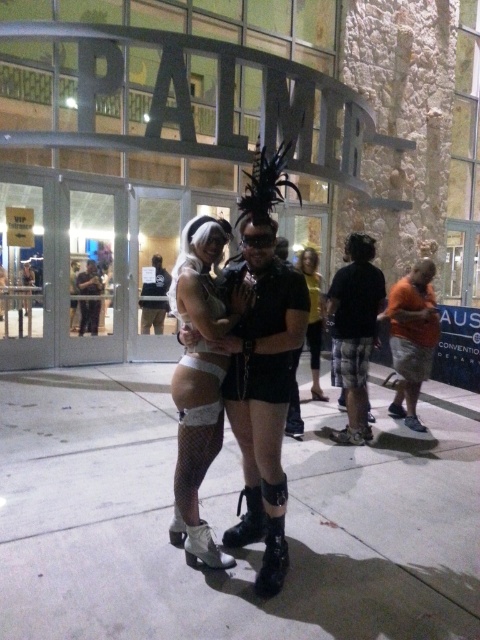
Question: Observing the image, what is the correct spatial positioning of white concrete pavement at center in reference to dark brown leather jacket at center?

Choices:
 (A) below
 (B) above

Answer: (A)

Question: Does white concrete pavement at center have a lesser width compared to orange cotton t-shirt at right?

Choices:
 (A) no
 (B) yes

Answer: (A)

Question: Which of the following is the farthest from the observer?

Choices:
 (A) (95, 307)
 (B) (361, 252)

Answer: (A)

Question: Estimate the real-world distances between objects in this image. Which object is closer to the black plaid shorts at center?

Choices:
 (A) orange cotton t-shirt at right
 (B) dark brown leather jacket at center
 (C) matte black shorts at center

Answer: (A)

Question: Does white fishnet stockings at center have a larger size compared to black leather jacket at center?

Choices:
 (A) no
 (B) yes

Answer: (A)

Question: Estimate the real-world distances between objects in this image. Which object is closer to the white fishnet stockings at center?

Choices:
 (A) dark brown leather jacket at center
 (B) white concrete pavement at center
 (C) black leather boots at center
 (D) black leather jacket at center

Answer: (C)